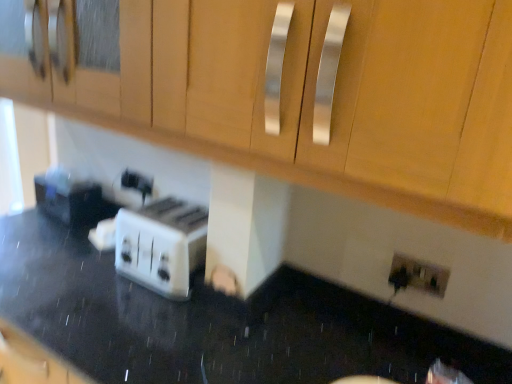
Question: Does white glossy toaster at lower left have a smaller size compared to white plastic toaster at center?

Choices:
 (A) no
 (B) yes

Answer: (A)

Question: From a real-world perspective, does white glossy toaster at lower left sit lower than white plastic toaster at center?

Choices:
 (A) no
 (B) yes

Answer: (B)

Question: Does white glossy toaster at lower left come behind white plastic toaster at center?

Choices:
 (A) yes
 (B) no

Answer: (B)

Question: Does white glossy toaster at lower left have a greater width compared to white plastic toaster at center?

Choices:
 (A) no
 (B) yes

Answer: (B)

Question: From the image's perspective, is white glossy toaster at lower left over white plastic toaster at center?

Choices:
 (A) yes
 (B) no

Answer: (B)

Question: Would you say white plastic toaster at center is part of white glossy toaster at lower left's contents?

Choices:
 (A) no
 (B) yes

Answer: (A)

Question: Is white plastic toaster at center positioned with its back to white plastic electric outlet at lower right?

Choices:
 (A) no
 (B) yes

Answer: (A)

Question: Is white plastic electric outlet at lower right located within white plastic toaster at center?

Choices:
 (A) yes
 (B) no

Answer: (B)

Question: Is white plastic toaster at center in contact with white plastic electric outlet at lower right?

Choices:
 (A) yes
 (B) no

Answer: (B)

Question: Is white plastic toaster at center smaller than white plastic electric outlet at lower right?

Choices:
 (A) no
 (B) yes

Answer: (A)

Question: Considering the relative sizes of white plastic toaster at center and white plastic electric outlet at lower right in the image provided, is white plastic toaster at center shorter than white plastic electric outlet at lower right?

Choices:
 (A) no
 (B) yes

Answer: (A)

Question: Is white plastic toaster at center located outside white plastic electric outlet at lower right?

Choices:
 (A) yes
 (B) no

Answer: (A)

Question: From the image's perspective, is white glossy toaster at lower left over white plastic electric outlet at lower right?

Choices:
 (A) yes
 (B) no

Answer: (B)